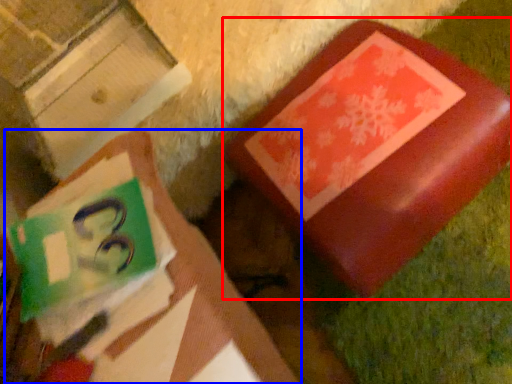
Question: Which object is further to the camera taking this photo, furniture (highlighted by a red box) or book (highlighted by a blue box)?

Choices:
 (A) furniture
 (B) book

Answer: (A)